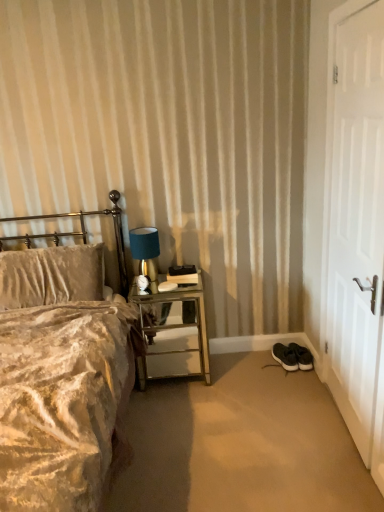
This screenshot has width=384, height=512. I want to click on vacant region to the left of black suede sneakers at lower right, the 2th footwear in the right-to-left sequence, so click(x=260, y=359).